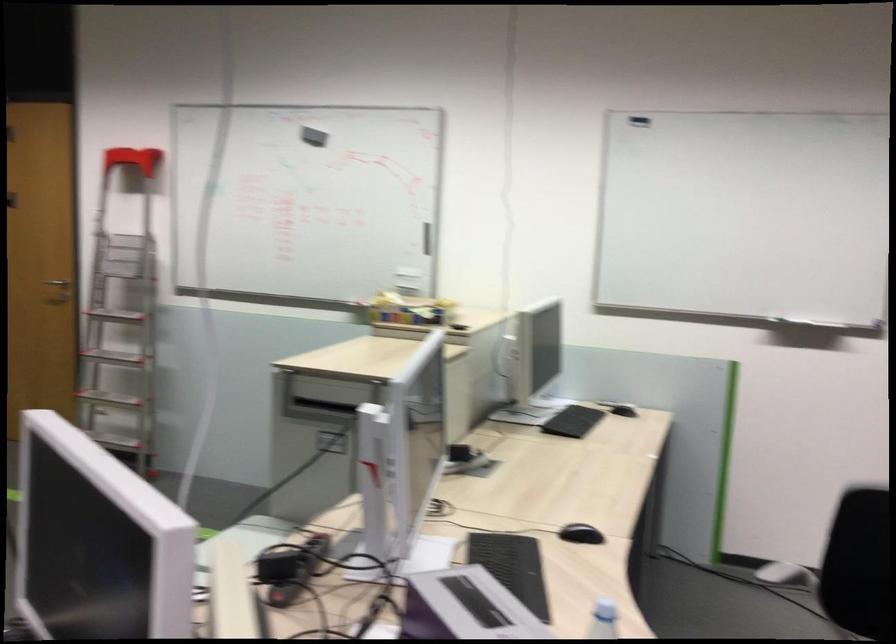
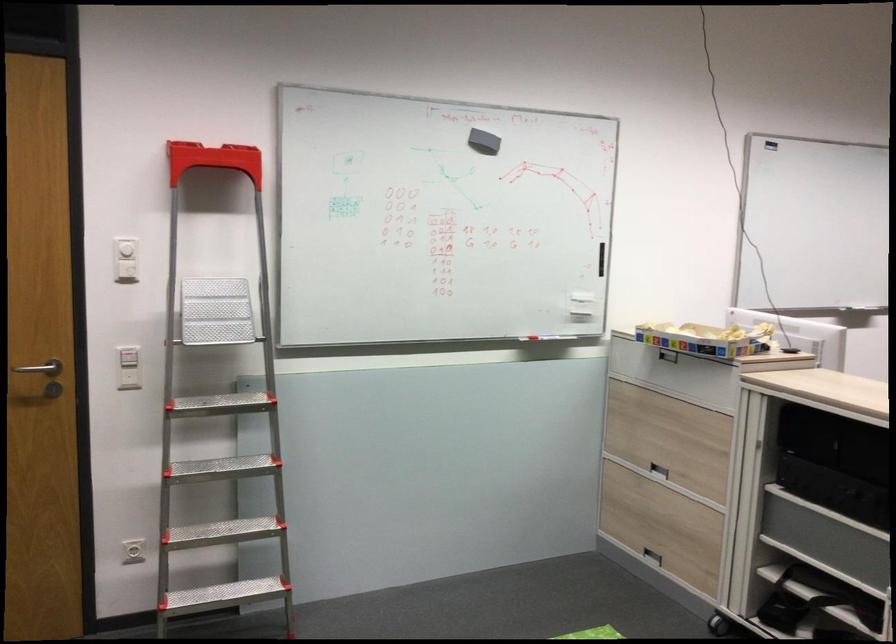
Find the pixel in the second image that matches the point at 380,304 in the first image.

(705, 339)